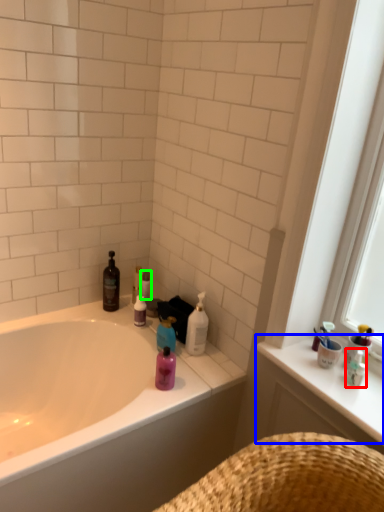
Question: Which object is the closest to the toiletry (highlighted by a red box)? Choose among these: counter top (highlighted by a blue box) or toilet paper (highlighted by a green box).

Choices:
 (A) counter top
 (B) toilet paper

Answer: (A)